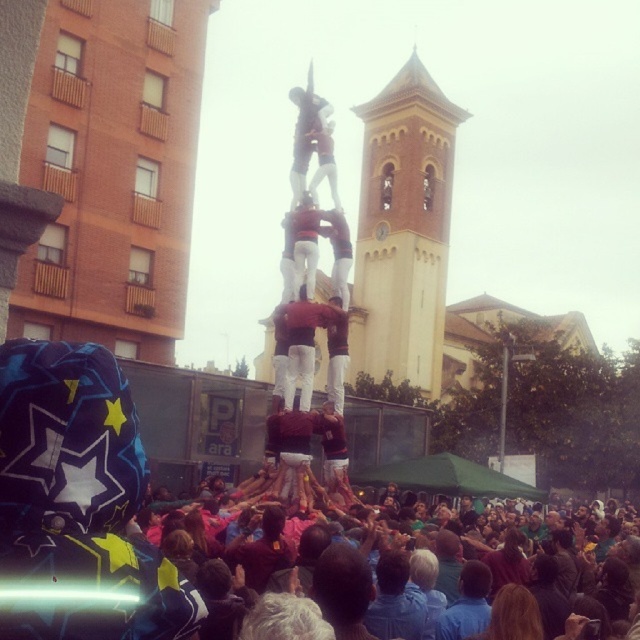
How far apart are dark blue fabric crowd at lower center and yellow brick tower at upper center?

The distance of dark blue fabric crowd at lower center from yellow brick tower at upper center is 50.55 meters.

Find the location of a particular element. dark blue fabric crowd at lower center is located at coordinates (445, 568).

You are a GUI agent. You are given a task and a screenshot of the screen. Output one action in this format:
    pyautogui.click(x=<x>, y=<y>)
    Task: Click on the dark blue fabric crowd at lower center
    This screenshot has height=640, width=640.
    Given the screenshot: What is the action you would take?
    pyautogui.click(x=445, y=568)

Consider the image. Does dark blue fabric crowd at lower center have a greater width compared to matte red shirt at center?

Yes.

Consider the image. How distant is dark blue fabric crowd at lower center from matte red shirt at center?

dark blue fabric crowd at lower center is 49.34 feet away from matte red shirt at center.

Which is behind, point (554, 541) or point (312, 332)?

The point (312, 332) is behind.

Find the location of a particular element. The width and height of the screenshot is (640, 640). dark blue fabric crowd at lower center is located at coordinates (445, 568).

Can you confirm if yellow brick tower at upper center is wider than matte red shirt at center?

Yes.

Who is more forward, (x=428, y=369) or (x=291, y=403)?

Point (x=291, y=403)

You are a GUI agent. You are given a task and a screenshot of the screen. Output one action in this format:
    pyautogui.click(x=<x>, y=<y>)
    Task: Click on the yellow brick tower at upper center
    This screenshot has width=640, height=640.
    Given the screenshot: What is the action you would take?
    pyautogui.click(x=403, y=228)